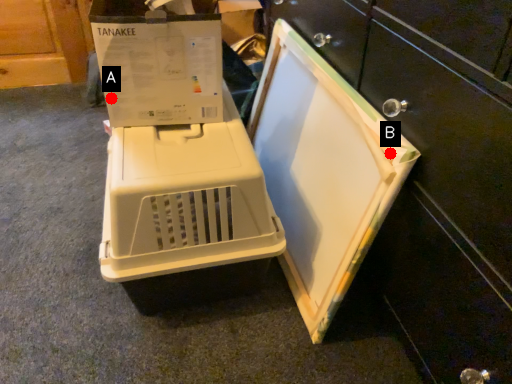
Question: Two points are circled on the image, labeled by A and B beside each circle. Which point appears farthest from the camera in this image?

Choices:
 (A) A is further
 (B) B is further

Answer: (A)